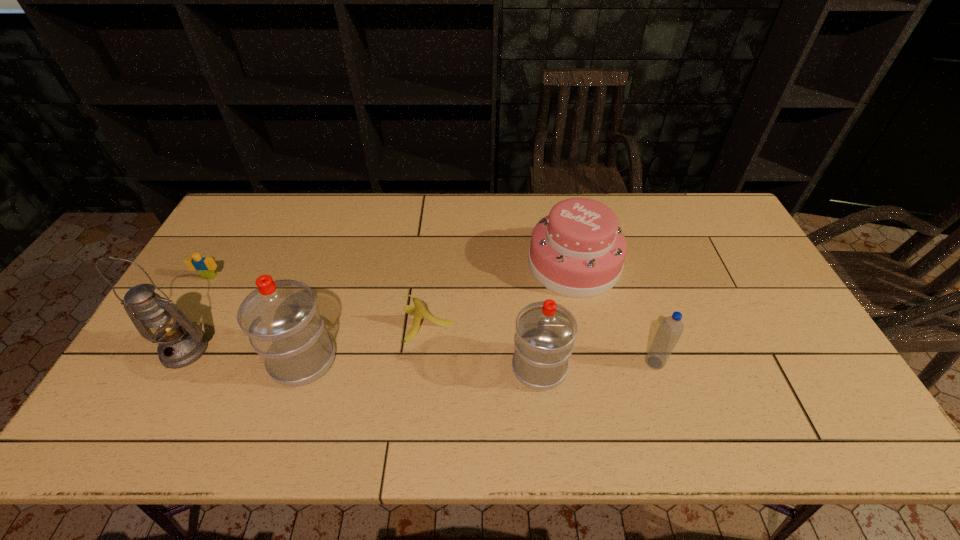
In order to click on free space for a new water bottle on the right in this screenshot , I will do `click(782, 376)`.